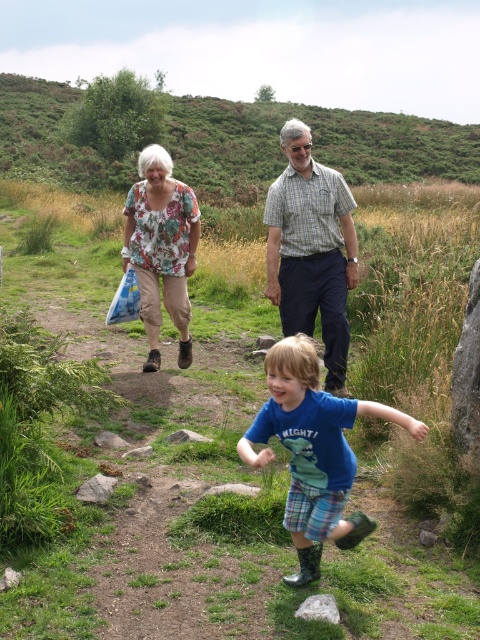
You are standing at the point with coordinates point (301, 449) and want to walk towards the point with coordinates point (458, 273). Which direction should you move in relation to the camera?

You should move away from the camera because point (458, 273) is further away from the camera than point (301, 449).